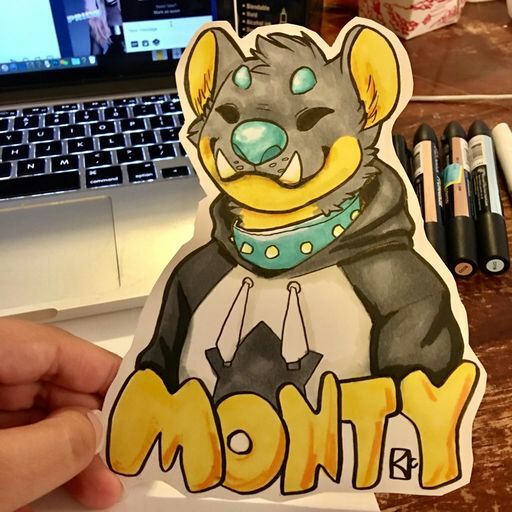
The width and height of the screenshot is (512, 512). Identify the location of wooden desktop. (496, 319), (465, 48).